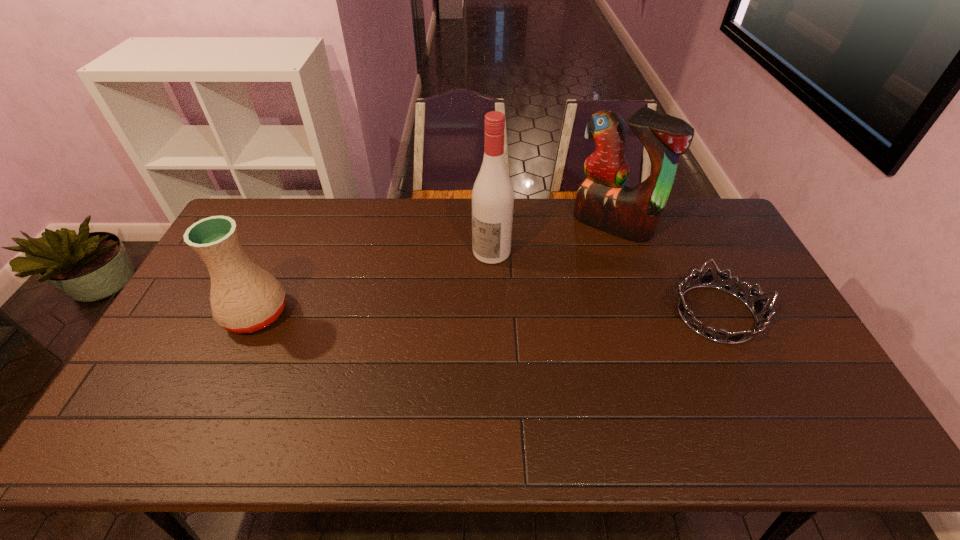
The image size is (960, 540). Identify the location of vacant space on the desktop that is between the pottery and the tiara and is positioned at the face of the parrot. (537, 314).

Where is `free space on the desktop that is between the pottery and the shortest object and is positioned on the label of the second object from left to right`? The width and height of the screenshot is (960, 540). free space on the desktop that is between the pottery and the shortest object and is positioned on the label of the second object from left to right is located at coordinates (439, 314).